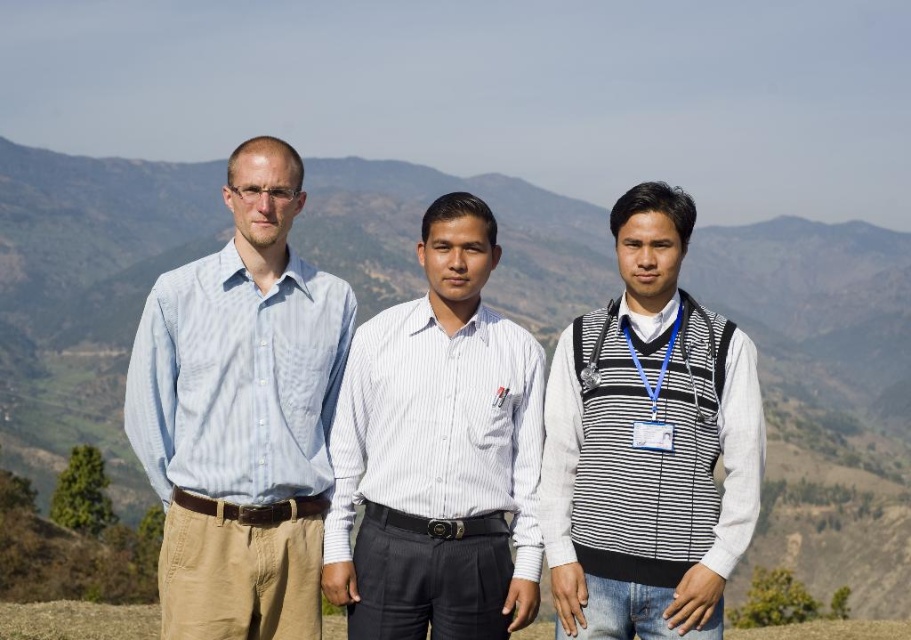
Measure the distance between light blue striped shirt at left and silver metallic medal at center.

light blue striped shirt at left and silver metallic medal at center are 10.12 meters apart from each other.

Image resolution: width=911 pixels, height=640 pixels. Describe the element at coordinates (241, 413) in the screenshot. I see `light blue striped shirt at left` at that location.

Find the location of `light blue striped shirt at left`. light blue striped shirt at left is located at coordinates (241, 413).

Who is higher up, white striped shirt at center or silver metallic medal at center?

Positioned higher is silver metallic medal at center.

Can you confirm if white striped shirt at center is positioned to the left of silver metallic medal at center?

Indeed, white striped shirt at center is positioned on the left side of silver metallic medal at center.

Is point (392, 308) closer to camera compared to point (597, 384)?

No, it is behind (597, 384).

Find the location of a particular element. The width and height of the screenshot is (911, 640). white striped shirt at center is located at coordinates (438, 452).

Can you confirm if light blue striped shirt at left is positioned to the left of striped sweater vest at center?

Yes, light blue striped shirt at left is to the left of striped sweater vest at center.

Is point (242, 358) positioned in front of point (585, 436)?

No.

Where is `light blue striped shirt at left`? This screenshot has height=640, width=911. light blue striped shirt at left is located at coordinates (241, 413).